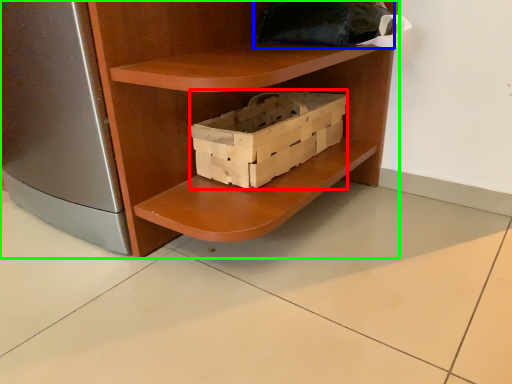
Question: Which object is positioned farthest from box (highlighted by a red box)? Select from pillow (highlighted by a blue box) and shelf (highlighted by a green box).

Choices:
 (A) pillow
 (B) shelf

Answer: (A)